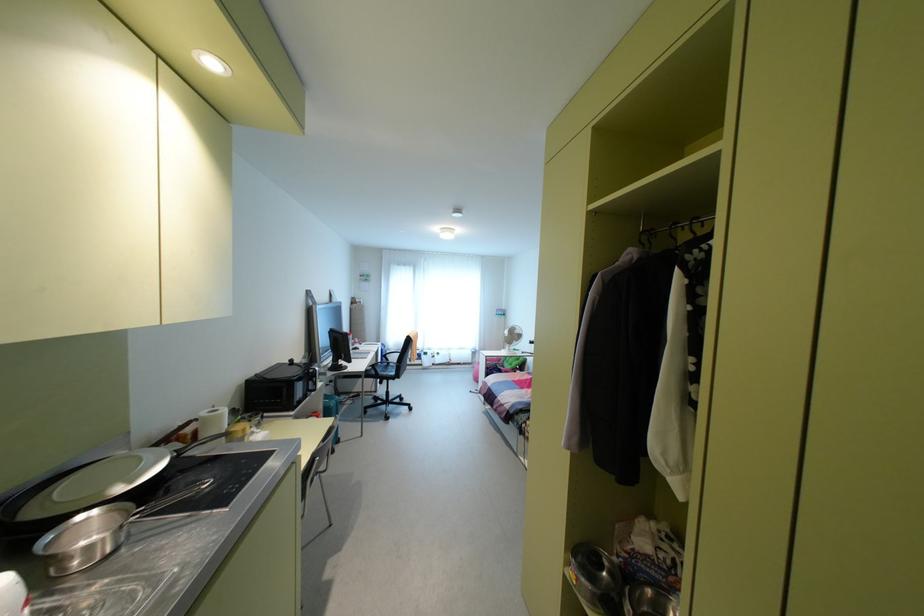
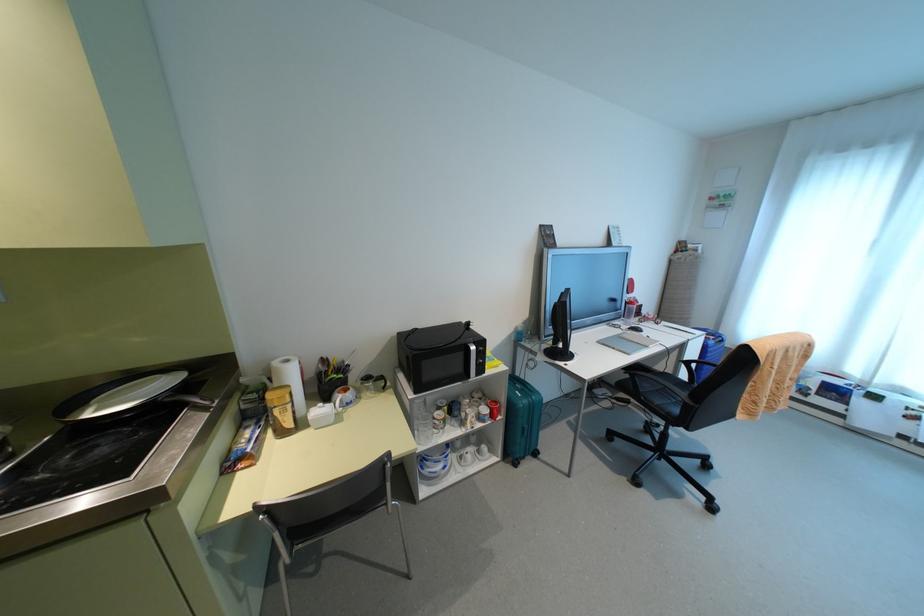
Where in the second image is the point corresponding to [337,440] from the first image?

(535, 454)